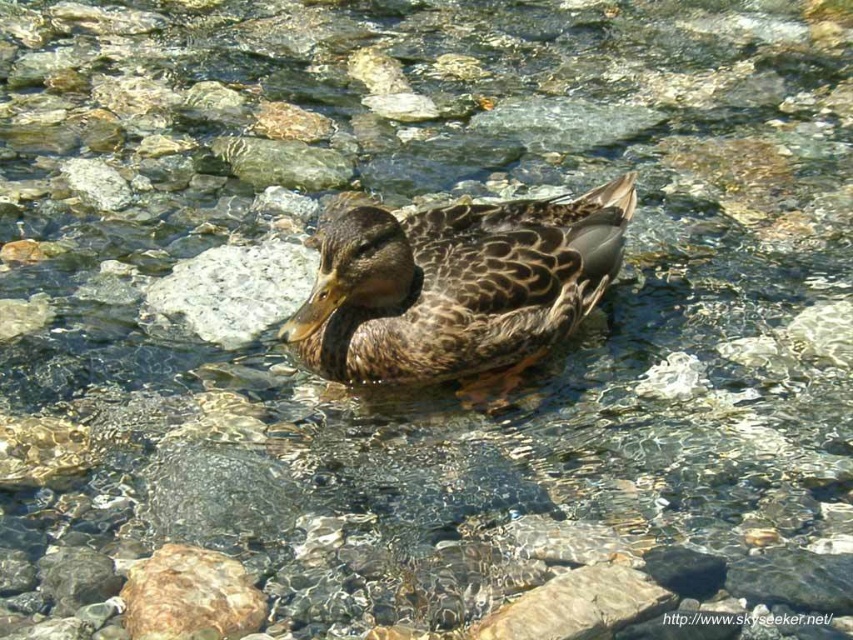
Who is taller, brown speckled feathers at center or brown rough rock at lower left?

brown speckled feathers at center

Which of these two, brown speckled feathers at center or brown rough rock at lower left, stands shorter?

With less height is brown rough rock at lower left.

Identify the location of brown speckled feathers at center. This screenshot has width=853, height=640. (457, 289).

Locate an element on the screen. This screenshot has height=640, width=853. brown speckled feathers at center is located at coordinates (457, 289).

Between brown speckled feathers at center and gray smooth rock at center, which one is positioned lower?

brown speckled feathers at center is below.

Which of these two, brown speckled feathers at center or gray smooth rock at center, stands taller?

With more height is brown speckled feathers at center.

Between point (612, 273) and point (198, 259), which one is positioned behind?

Positioned behind is point (198, 259).

This screenshot has width=853, height=640. Find the location of `brown speckled feathers at center`. brown speckled feathers at center is located at coordinates (457, 289).

You are a GUI agent. You are given a task and a screenshot of the screen. Output one action in this format:
    pyautogui.click(x=<x>, y=<y>)
    Task: Click on the gray smooth rock at center
    The height and width of the screenshot is (640, 853).
    Given the screenshot: What is the action you would take?
    pyautogui.click(x=234, y=289)

Between point (299, 289) and point (236, 582), which one is positioned in front?

Positioned in front is point (236, 582).

Where is `gray smooth rock at center`? gray smooth rock at center is located at coordinates (234, 289).